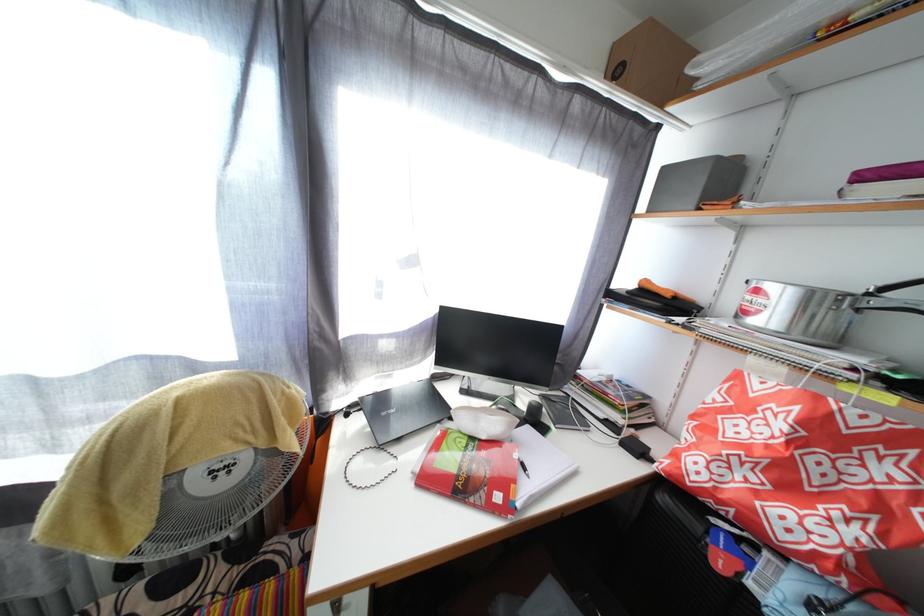
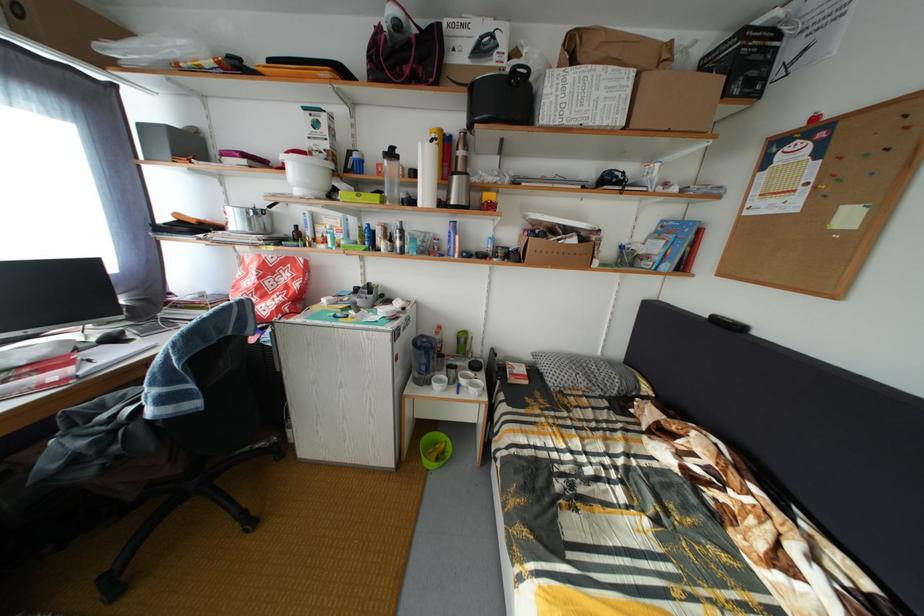
In the second image, find the point that corresponds to pixel 492 444 in the first image.

(31, 370)